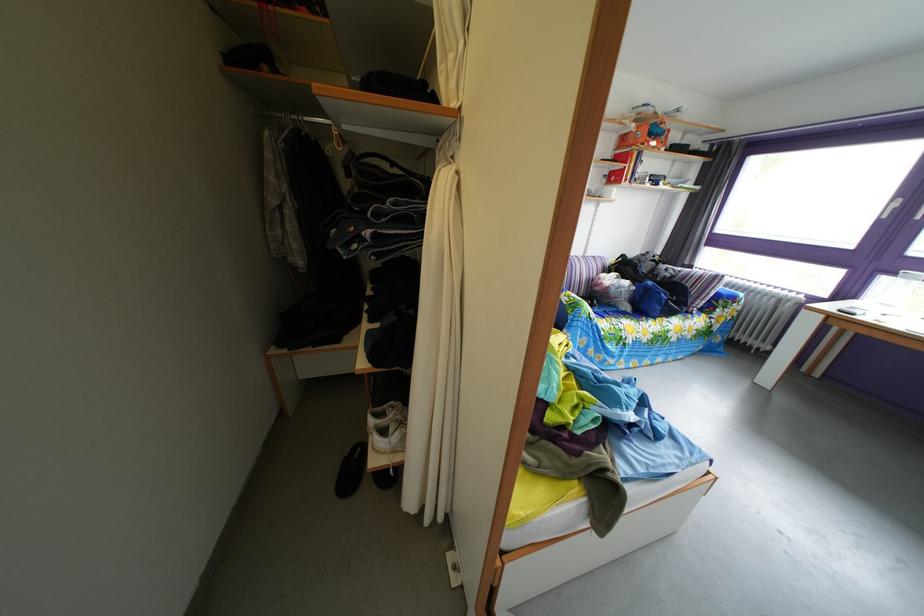
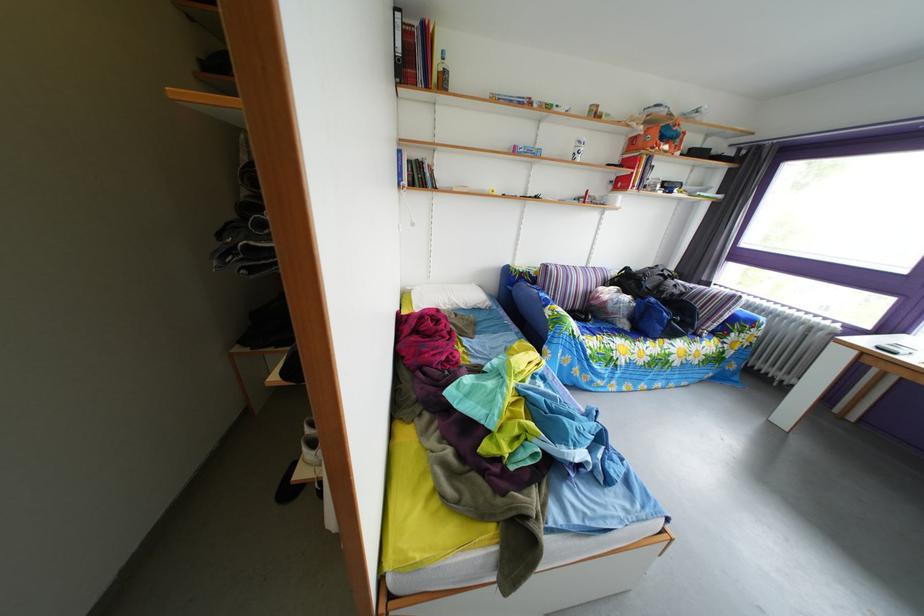
Question: The camera is either moving clockwise (left) or counter-clockwise (right) around the object. The first image is from the beginning of the video and the second image is from the end. Is the camera moving left or right when shooting the video?

Choices:
 (A) Left
 (B) Right

Answer: (B)